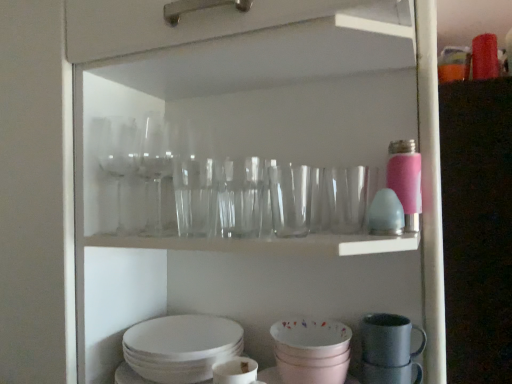
What is the approximate height of matte pink bowl at lower center, marked as the second tableware in a left-to-right arrangement?

The height of matte pink bowl at lower center, marked as the second tableware in a left-to-right arrangement, is 3.52 inches.

Image resolution: width=512 pixels, height=384 pixels. What do you see at coordinates (311, 351) in the screenshot?
I see `matte pink bowl at lower center, marked as the second tableware in a left-to-right arrangement` at bounding box center [311, 351].

Describe the element at coordinates (391, 374) in the screenshot. This screenshot has height=384, width=512. I see `matte gray mug at lower right, which is counted as the fourth tableware, starting from the left` at that location.

Locate an element on the screen. This screenshot has width=512, height=384. matte gray mug at lower right, placed as the third tableware when sorted from left to right is located at coordinates (388, 340).

The height and width of the screenshot is (384, 512). Find the location of `white matte mug at lower center, the 4th tableware from the right`. white matte mug at lower center, the 4th tableware from the right is located at coordinates (234, 371).

Based on the photo, measure the distance between white matte mug at lower center, the first tableware in the left-to-right sequence, and camera.

The distance of white matte mug at lower center, the first tableware in the left-to-right sequence, from camera is 27.37 inches.

In order to click on matte pink bowl at lower center, marked as the second tableware in a left-to-right arrangement in this screenshot , I will do `click(311, 351)`.

Considering the sizes of objects matte pink bowl at lower center, marked as the second tableware in a left-to-right arrangement, and white matte mug at lower center, the first tableware in the left-to-right sequence, in the image provided, who is thinner, matte pink bowl at lower center, marked as the second tableware in a left-to-right arrangement, or white matte mug at lower center, the first tableware in the left-to-right sequence,?

Thinner between the two is white matte mug at lower center, the first tableware in the left-to-right sequence.

From the image's perspective, which one is positioned lower, matte pink bowl at lower center, marked as the second tableware in a left-to-right arrangement, or white matte mug at lower center, the 4th tableware from the right?

white matte mug at lower center, the 4th tableware from the right.

Considering the positions of objects matte pink bowl at lower center, marked as the second tableware in a left-to-right arrangement, and white matte mug at lower center, the first tableware in the left-to-right sequence, in the image provided, who is more to the left, matte pink bowl at lower center, marked as the second tableware in a left-to-right arrangement, or white matte mug at lower center, the first tableware in the left-to-right sequence,?

white matte mug at lower center, the first tableware in the left-to-right sequence.

From the picture: Is matte pink bowl at lower center, marked as the second tableware in a left-to-right arrangement, shorter than white matte mug at lower center, the 4th tableware from the right?

Indeed, matte pink bowl at lower center, marked as the second tableware in a left-to-right arrangement, has a lesser height compared to white matte mug at lower center, the 4th tableware from the right.

Do you think white matte mug at lower center, the 4th tableware from the right, is within matte gray mug at lower right, acting as the first tableware starting from the right, or outside of it?

white matte mug at lower center, the 4th tableware from the right, is not enclosed by matte gray mug at lower right, acting as the first tableware starting from the right.

Looking at this image, which point is more forward, (248, 377) or (376, 377)?

The point (248, 377) is closer to the camera.

Is white matte mug at lower center, the first tableware in the left-to-right sequence, further to camera compared to matte gray mug at lower right, acting as the first tableware starting from the right?

No, white matte mug at lower center, the first tableware in the left-to-right sequence, is closer to the viewer.

Which of these two, white matte mug at lower center, the 4th tableware from the right, or matte gray mug at lower right, acting as the first tableware starting from the right, stands shorter?

With less height is matte gray mug at lower right, acting as the first tableware starting from the right.

From the image's perspective, is matte gray mug at lower right, placed as the third tableware when sorted from left to right, located beneath white matte mug at lower center, the 4th tableware from the right?

Incorrect, from the image's perspective, matte gray mug at lower right, placed as the third tableware when sorted from left to right, is higher than white matte mug at lower center, the 4th tableware from the right.

Can we say matte gray mug at lower right, placed as the third tableware when sorted from left to right, lies outside white matte mug at lower center, the 4th tableware from the right?

Yes.

Is matte gray mug at lower right, marked as the 2th tableware in a right-to-left arrangement, turned away from white matte mug at lower center, the first tableware in the left-to-right sequence?

That's not correct — matte gray mug at lower right, marked as the 2th tableware in a right-to-left arrangement, is not looking away from white matte mug at lower center, the first tableware in the left-to-right sequence.

From a real-world perspective, is matte pink bowl at lower center, marked as the second tableware in a left-to-right arrangement, located higher than matte gray mug at lower right, which is counted as the fourth tableware, starting from the left?

Yes.

In the scene shown: From the image's perspective, is matte pink bowl at lower center, which ranks as the third tableware in right-to-left order, beneath matte gray mug at lower right, acting as the first tableware starting from the right?

No.

In the image, is matte pink bowl at lower center, marked as the second tableware in a left-to-right arrangement, positioned in front of or behind matte gray mug at lower right, acting as the first tableware starting from the right?

In the image, matte pink bowl at lower center, marked as the second tableware in a left-to-right arrangement, appears in front of matte gray mug at lower right, acting as the first tableware starting from the right.

Does matte gray mug at lower right, which is counted as the fourth tableware, starting from the left, have a smaller size compared to matte pink bowl at lower center, which ranks as the third tableware in right-to-left order?

Correct, matte gray mug at lower right, which is counted as the fourth tableware, starting from the left, occupies less space than matte pink bowl at lower center, which ranks as the third tableware in right-to-left order.

Is matte gray mug at lower right, acting as the first tableware starting from the right, taller or shorter than matte pink bowl at lower center, which ranks as the third tableware in right-to-left order?

Clearly, matte gray mug at lower right, acting as the first tableware starting from the right, is shorter compared to matte pink bowl at lower center, which ranks as the third tableware in right-to-left order.

From a real-world perspective, is matte gray mug at lower right, which is counted as the fourth tableware, starting from the left, over matte pink bowl at lower center, which ranks as the third tableware in right-to-left order?

Incorrect, from a real-world perspective, matte gray mug at lower right, which is counted as the fourth tableware, starting from the left, is lower than matte pink bowl at lower center, which ranks as the third tableware in right-to-left order.

Is point (375, 374) behind point (297, 338)?

No, it is not.

Is matte gray mug at lower right, which is counted as the fourth tableware, starting from the left, oriented away from white matte mug at lower center, the 4th tableware from the right?

No.

In the scene shown: Which object is positioned more to the right, matte gray mug at lower right, which is counted as the fourth tableware, starting from the left, or white matte mug at lower center, the 4th tableware from the right?

Positioned to the right is matte gray mug at lower right, which is counted as the fourth tableware, starting from the left.

From a real-world perspective, starting from the matte gray mug at lower right, marked as the 2th tableware in a right-to-left arrangement, which tableware is the 1st one below it? Please provide its 2D coordinates.

[(311, 351)]

Which is correct: matte pink bowl at lower center, which ranks as the third tableware in right-to-left order, is inside matte gray mug at lower right, marked as the 2th tableware in a right-to-left arrangement, or outside of it?

matte pink bowl at lower center, which ranks as the third tableware in right-to-left order, lies outside matte gray mug at lower right, marked as the 2th tableware in a right-to-left arrangement.

In the scene shown: Which object is further away from the camera, matte pink bowl at lower center, which ranks as the third tableware in right-to-left order, or matte gray mug at lower right, marked as the 2th tableware in a right-to-left arrangement?

matte gray mug at lower right, marked as the 2th tableware in a right-to-left arrangement.

Is matte pink bowl at lower center, marked as the second tableware in a left-to-right arrangement, in contact with matte gray mug at lower right, marked as the 2th tableware in a right-to-left arrangement?

No, matte pink bowl at lower center, marked as the second tableware in a left-to-right arrangement, is not next to matte gray mug at lower right, marked as the 2th tableware in a right-to-left arrangement.

Where is `the 1st tableware located above the white matte mug at lower center, the first tableware in the left-to-right sequence (from a real-world perspective)`? the 1st tableware located above the white matte mug at lower center, the first tableware in the left-to-right sequence (from a real-world perspective) is located at coordinates (311, 351).

From the image's perspective, starting from the white matte mug at lower center, the 4th tableware from the right, which tableware is the 1st one above? Please provide its 2D coordinates.

[(391, 374)]

From the image, which object appears to be farther from matte pink bowl at lower center, which ranks as the third tableware in right-to-left order, matte gray mug at lower right, marked as the 2th tableware in a right-to-left arrangement, or matte gray mug at lower right, acting as the first tableware starting from the right?

matte gray mug at lower right, acting as the first tableware starting from the right, lies further to matte pink bowl at lower center, which ranks as the third tableware in right-to-left order, than the other object.

Estimate the real-world distances between objects in this image. Which object is closer to matte gray mug at lower right, acting as the first tableware starting from the right, white matte mug at lower center, the 4th tableware from the right, or matte gray mug at lower right, marked as the 2th tableware in a right-to-left arrangement?

matte gray mug at lower right, marked as the 2th tableware in a right-to-left arrangement, is positioned closer to the anchor matte gray mug at lower right, acting as the first tableware starting from the right.

When comparing their distances from matte gray mug at lower right, acting as the first tableware starting from the right, does matte pink bowl at lower center, marked as the second tableware in a left-to-right arrangement, or white matte mug at lower center, the 4th tableware from the right, seem further?

white matte mug at lower center, the 4th tableware from the right, lies further to matte gray mug at lower right, acting as the first tableware starting from the right, than the other object.

Looking at the image, which one is located further to matte gray mug at lower right, marked as the 2th tableware in a right-to-left arrangement, matte gray mug at lower right, acting as the first tableware starting from the right, or matte pink bowl at lower center, marked as the second tableware in a left-to-right arrangement?

matte pink bowl at lower center, marked as the second tableware in a left-to-right arrangement, is further to matte gray mug at lower right, marked as the 2th tableware in a right-to-left arrangement.

Based on their spatial positions, is matte gray mug at lower right, marked as the 2th tableware in a right-to-left arrangement, or white matte mug at lower center, the first tableware in the left-to-right sequence, closer to matte pink bowl at lower center, which ranks as the third tableware in right-to-left order?

Based on the image, matte gray mug at lower right, marked as the 2th tableware in a right-to-left arrangement, appears to be nearer to matte pink bowl at lower center, which ranks as the third tableware in right-to-left order.

From the image, which object appears to be nearer to matte pink bowl at lower center, which ranks as the third tableware in right-to-left order, matte gray mug at lower right, acting as the first tableware starting from the right, or matte gray mug at lower right, marked as the 2th tableware in a right-to-left arrangement?

matte gray mug at lower right, marked as the 2th tableware in a right-to-left arrangement, lies closer to matte pink bowl at lower center, which ranks as the third tableware in right-to-left order, than the other object.

Looking at the image, which one is located further to matte gray mug at lower right, placed as the third tableware when sorted from left to right, white matte mug at lower center, the 4th tableware from the right, or matte pink bowl at lower center, which ranks as the third tableware in right-to-left order?

white matte mug at lower center, the 4th tableware from the right, lies further to matte gray mug at lower right, placed as the third tableware when sorted from left to right, than the other object.

From the image, which object appears to be nearer to matte gray mug at lower right, acting as the first tableware starting from the right, matte gray mug at lower right, marked as the 2th tableware in a right-to-left arrangement, or white matte mug at lower center, the first tableware in the left-to-right sequence?

matte gray mug at lower right, marked as the 2th tableware in a right-to-left arrangement, lies closer to matte gray mug at lower right, acting as the first tableware starting from the right, than the other object.

This screenshot has width=512, height=384. I want to click on tableware located between white matte mug at lower center, the first tableware in the left-to-right sequence, and matte gray mug at lower right, placed as the third tableware when sorted from left to right, in the left-right direction, so click(x=311, y=351).

Where is `tableware situated between matte pink bowl at lower center, which ranks as the third tableware in right-to-left order, and matte gray mug at lower right, which is counted as the fourth tableware, starting from the left, from left to right`? tableware situated between matte pink bowl at lower center, which ranks as the third tableware in right-to-left order, and matte gray mug at lower right, which is counted as the fourth tableware, starting from the left, from left to right is located at coordinates (388, 340).